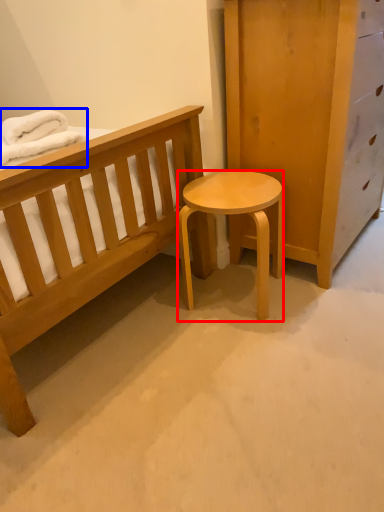
Question: Which object is further to the camera taking this photo, stool (highlighted by a red box) or blanket (highlighted by a blue box)?

Choices:
 (A) stool
 (B) blanket

Answer: (A)